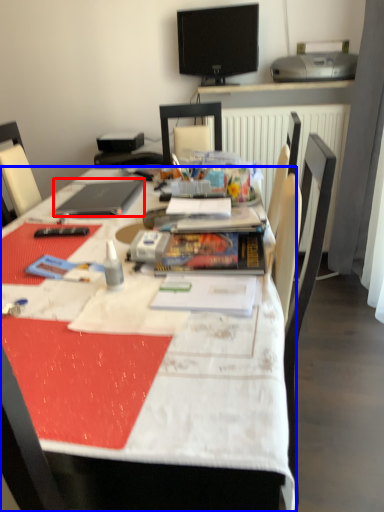
Question: Among these objects, which one is farthest to the camera, laptop (highlighted by a red box) or desk (highlighted by a blue box)?

Choices:
 (A) laptop
 (B) desk

Answer: (A)